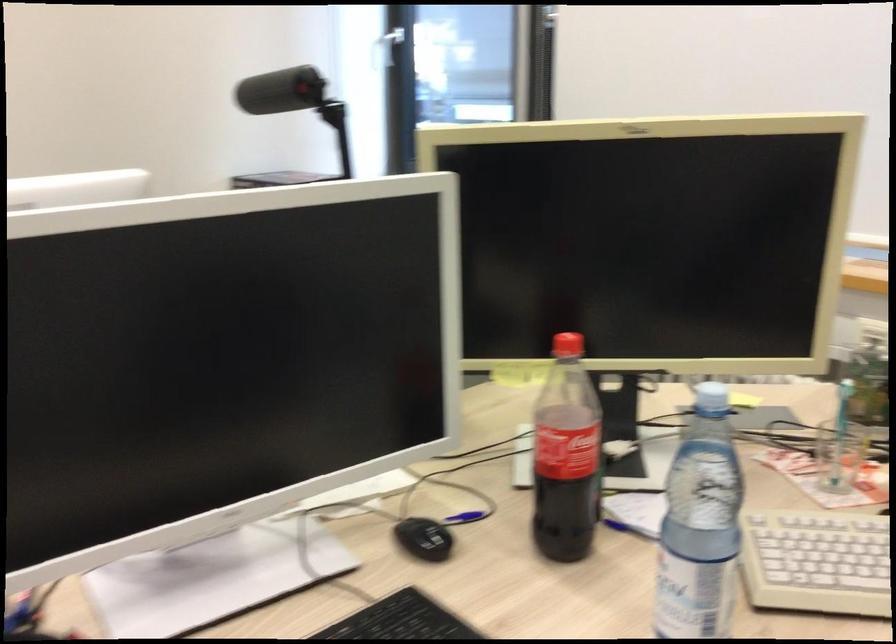
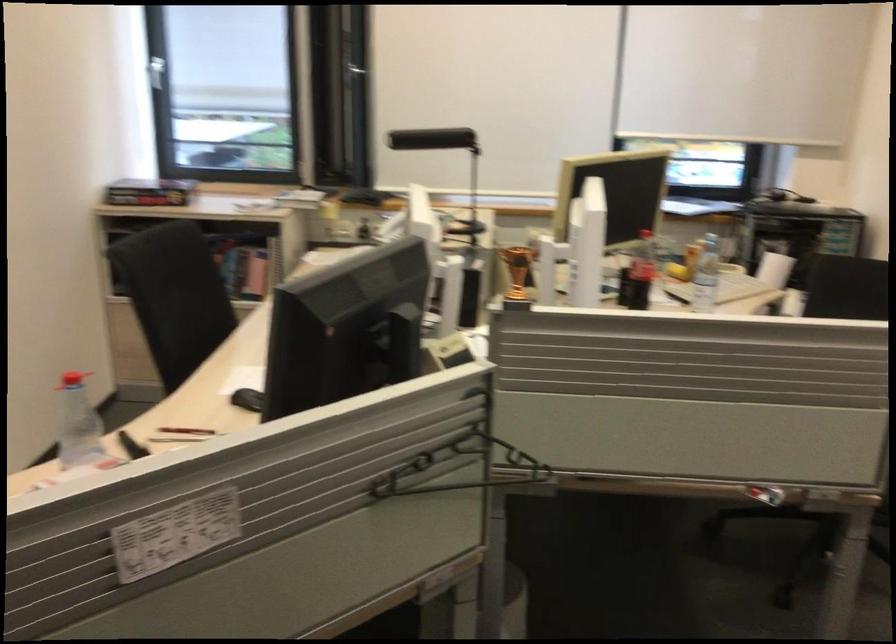
Where in the second image is the point corresponding to (x=711, y=398) from the first image?

(702, 232)